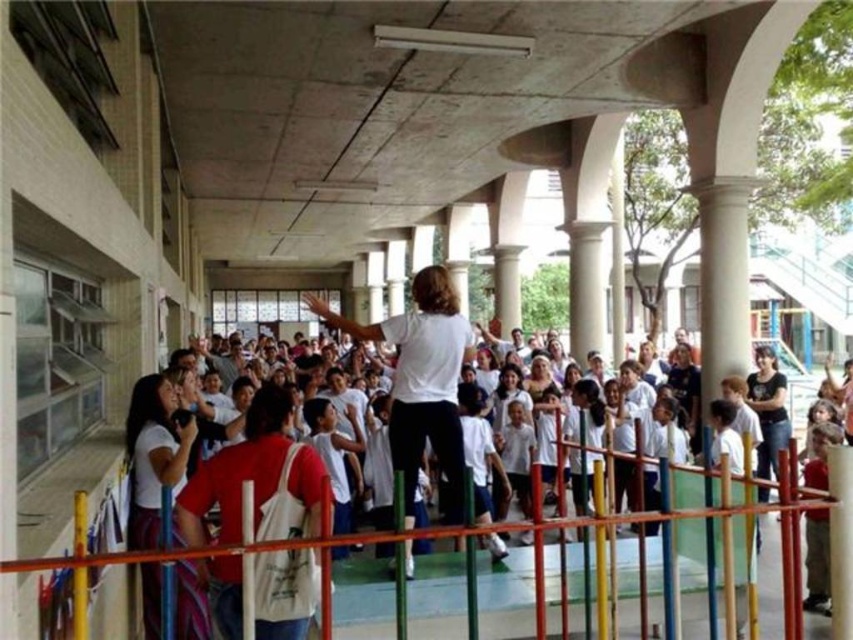
Question: Does white matte shirt at center appear under red cotton t-shirt at center?

Choices:
 (A) yes
 (B) no

Answer: (B)

Question: Can you confirm if white matte shirt at center is wider than red cotton t-shirt at center?

Choices:
 (A) yes
 (B) no

Answer: (A)

Question: Estimate the real-world distances between objects in this image. Which object is farther from the white cotton shirt at center?

Choices:
 (A) multicolored plastic fence at center
 (B) red cotton t-shirt at center
 (C) light brown wooden pole at right
 (D) white matte shirt at center

Answer: (B)

Question: Is light brown wooden pole at right thinner than white cotton shirt at center?

Choices:
 (A) yes
 (B) no

Answer: (B)

Question: Which point is closer to the camera?

Choices:
 (A) red cotton t-shirt at center
 (B) white cotton shirt at center
 (C) multicolored plastic fence at center

Answer: (A)

Question: Which of the following is the farthest from the observer?

Choices:
 (A) (238, 483)
 (B) (486, 536)

Answer: (B)